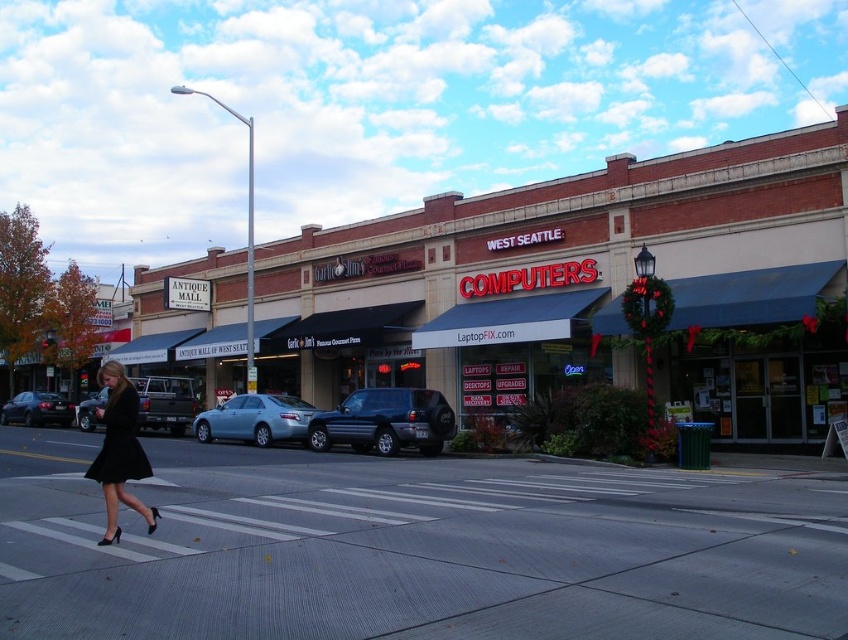
Does black asphalt at center have a lesser width compared to matte black sedan at lower left?

No, black asphalt at center is not thinner than matte black sedan at lower left.

Who is more distant from viewer, [774,545] or [47,420]?

Point [47,420]

Find the location of a particular element. The height and width of the screenshot is (640, 848). black asphalt at center is located at coordinates (428, 554).

Does black matte skirt at lower left have a greater width compared to matte black sedan at lower left?

Correct, the width of black matte skirt at lower left exceeds that of matte black sedan at lower left.

Which is in front, point (121, 445) or point (60, 403)?

Positioned in front is point (121, 445).

Is point (88, 477) farther from camera compared to point (18, 403)?

No, it is in front of (18, 403).

At what (x,y) coordinates should I click in order to perform the action: click on black matte skirt at lower left. Please return your answer as a coordinate pair (x, y). Image resolution: width=848 pixels, height=640 pixels. Looking at the image, I should click on (120, 451).

Can you confirm if satin silver suv at center is wider than satin blue sedan at center?

Yes, satin silver suv at center is wider than satin blue sedan at center.

Is point (383, 440) less distant than point (221, 436)?

Yes, it is.

Where is `satin silver suv at center`? The height and width of the screenshot is (640, 848). satin silver suv at center is located at coordinates (385, 420).